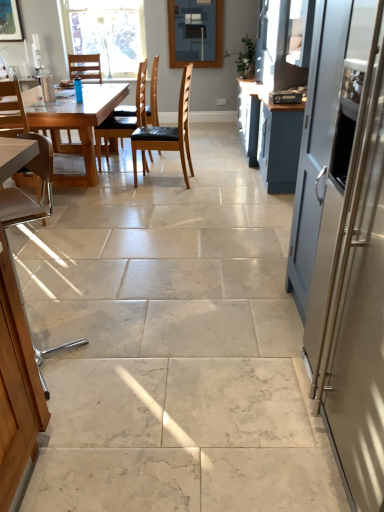
Question: Considering the relative sizes of satin silver refrigerator at right and clear glass window at upper center in the image provided, is satin silver refrigerator at right taller than clear glass window at upper center?

Choices:
 (A) yes
 (B) no

Answer: (A)

Question: Is satin silver refrigerator at right outside of clear glass window at upper center?

Choices:
 (A) yes
 (B) no

Answer: (A)

Question: Does satin silver refrigerator at right have a lesser width compared to clear glass window at upper center?

Choices:
 (A) no
 (B) yes

Answer: (A)

Question: Is the depth of satin silver refrigerator at right greater than that of clear glass window at upper center?

Choices:
 (A) no
 (B) yes

Answer: (A)

Question: Could you tell me if satin silver refrigerator at right is turned towards clear glass window at upper center?

Choices:
 (A) no
 (B) yes

Answer: (A)

Question: Is satin silver refrigerator at right facing away from clear glass window at upper center?

Choices:
 (A) no
 (B) yes

Answer: (A)

Question: Is blue plastic chair at upper left, the fourth chair when ordered from front to back, located outside matte glass window screen at upper center?

Choices:
 (A) no
 (B) yes

Answer: (B)

Question: Is blue plastic chair at upper left, the fourth chair when ordered from front to back, positioned behind matte glass window screen at upper center?

Choices:
 (A) yes
 (B) no

Answer: (B)

Question: Is blue plastic chair at upper left, the 1th chair from the back, not close to matte glass window screen at upper center?

Choices:
 (A) yes
 (B) no

Answer: (A)

Question: From the image's perspective, is blue plastic chair at upper left, the fourth chair when ordered from front to back, on matte glass window screen at upper center?

Choices:
 (A) yes
 (B) no

Answer: (B)

Question: Considering the relative sizes of blue plastic chair at upper left, the fourth chair when ordered from front to back, and matte glass window screen at upper center in the image provided, is blue plastic chair at upper left, the fourth chair when ordered from front to back, taller than matte glass window screen at upper center?

Choices:
 (A) yes
 (B) no

Answer: (B)

Question: Can you confirm if blue plastic chair at upper left, the fourth chair when ordered from front to back, is smaller than matte glass window screen at upper center?

Choices:
 (A) yes
 (B) no

Answer: (B)

Question: From the image's perspective, is satin silver refrigerator at right under matte glass window screen at upper center?

Choices:
 (A) no
 (B) yes

Answer: (B)